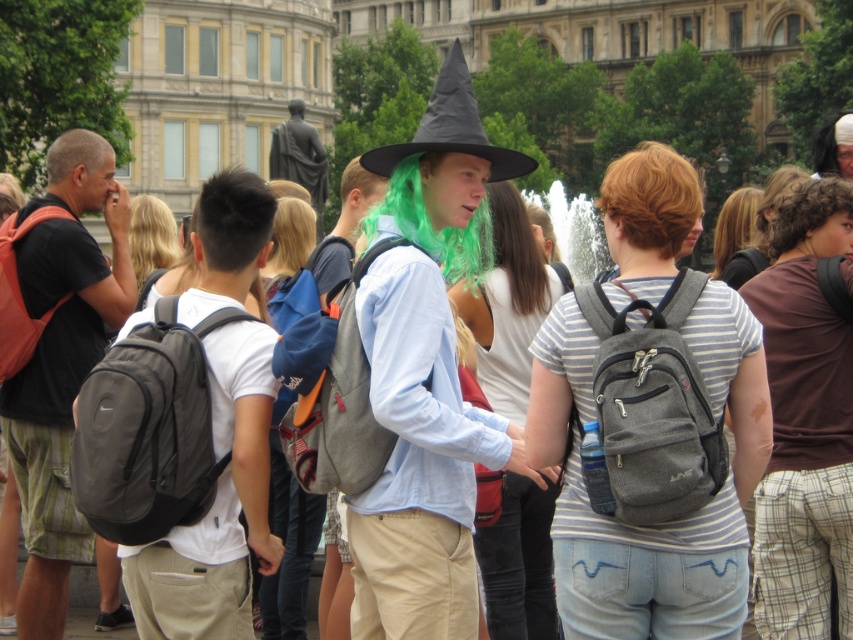
Does blonde curly hair at upper right have a larger size compared to black felt wizard hat at center?

Actually, blonde curly hair at upper right might be smaller than black felt wizard hat at center.

Who is higher up, blonde curly hair at upper right or black felt wizard hat at center?

Positioned higher is black felt wizard hat at center.

This screenshot has height=640, width=853. What are the coordinates of `blonde curly hair at upper right` in the screenshot? It's located at (651, 196).